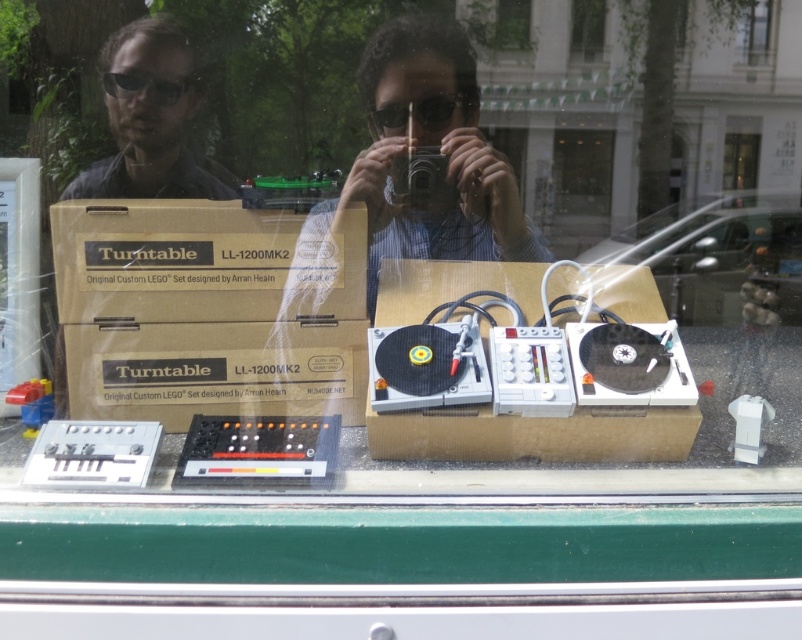
Does black plastic goggles at center have a larger size compared to clear glass window at upper center?

Yes, black plastic goggles at center is bigger than clear glass window at upper center.

Who is higher up, black plastic goggles at center or clear glass window at upper center?

clear glass window at upper center

Does point (401, 131) come closer to viewer compared to point (592, 42)?

Yes, point (401, 131) is in front of point (592, 42).

The image size is (802, 640). Find the location of `black plastic goggles at center`. black plastic goggles at center is located at coordinates (422, 113).

Who is positioned more to the left, brown cardboard at center or white cardboard box at center?

brown cardboard at center is more to the left.

Where is `brown cardboard at center`? Image resolution: width=802 pixels, height=640 pixels. brown cardboard at center is located at coordinates (209, 308).

Can you confirm if white cardboard box at center is thinner than transparent glass window at upper center?

No, white cardboard box at center is not thinner than transparent glass window at upper center.

Between point (497, 269) and point (764, 33), which one is positioned behind?

Point (764, 33)

Locate an element on the screen. This screenshot has width=802, height=640. white cardboard box at center is located at coordinates (533, 435).